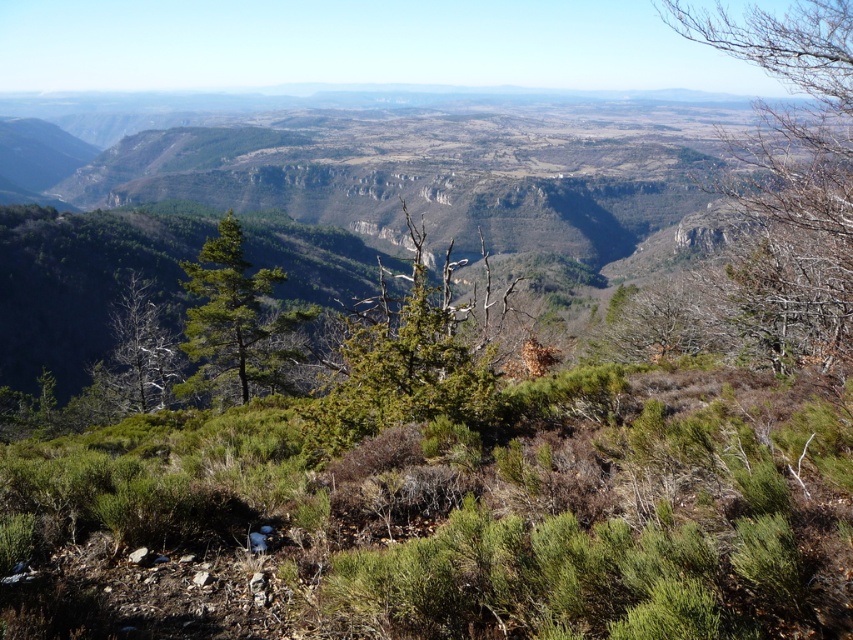
You are standing at the base of the mountain and see two points marked in the image. Which point, point (817, 202) or point (115, 305), is closer to you?

Point (817, 202) is in front of point (115, 305), so it is closer to you.

You are a hiker planning to take a photo of the green matte tree at center and the bare branches at upper right. Which object will appear larger in the photo due to its height?

The bare branches at upper right will appear larger in the photo because it is much taller than the green matte tree at center.

From the picture: You are an artist sketching the mountain landscape. You notice the bare branches at upper right and the green leafy tree at center. Which one appears wider in your drawing?

The bare branches at upper right appears wider than the green leafy tree at center because its width surpasses the latter.